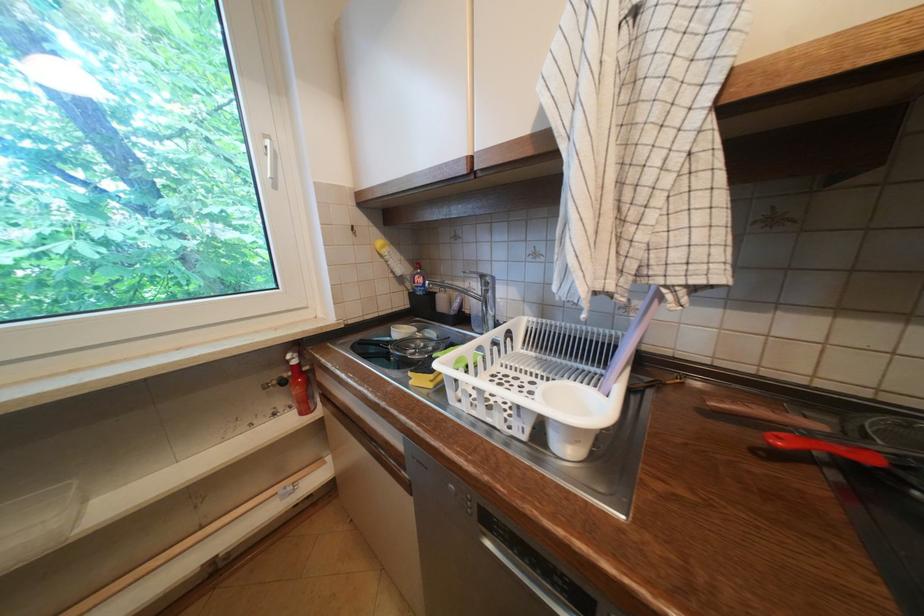
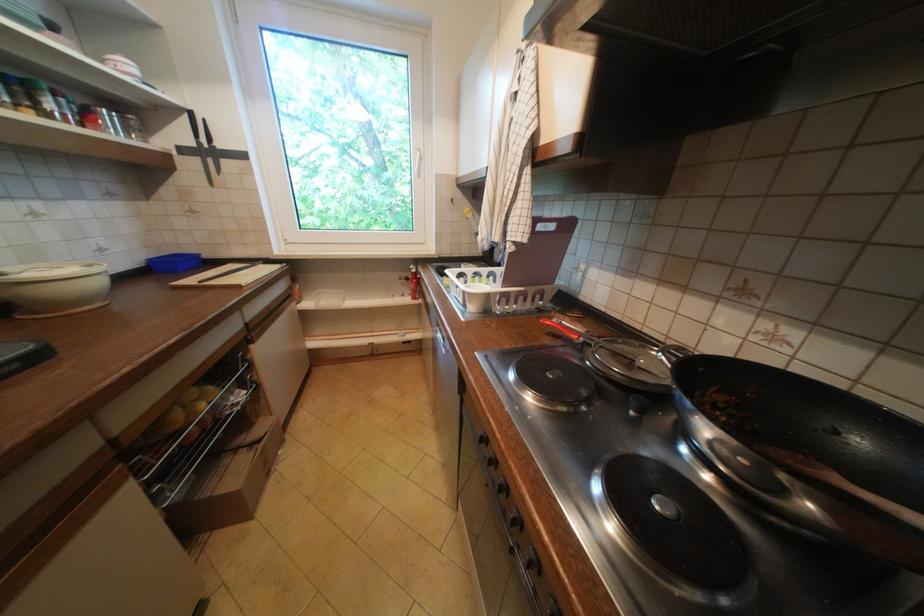
The point at [770,455] is marked in the first image. Where is the corresponding point in the second image?

(558, 334)